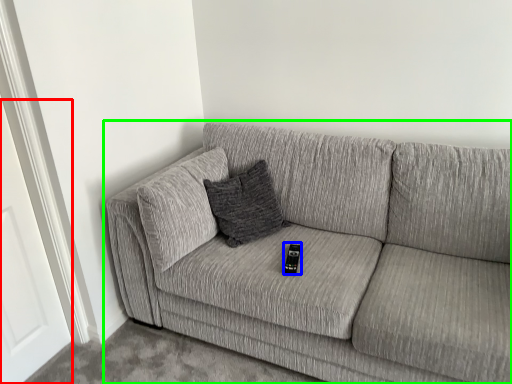
Question: Which object is the farthest from door (highlighted by a red box)? Choose among these: remote (highlighted by a blue box) or studio couch (highlighted by a green box).

Choices:
 (A) remote
 (B) studio couch

Answer: (A)